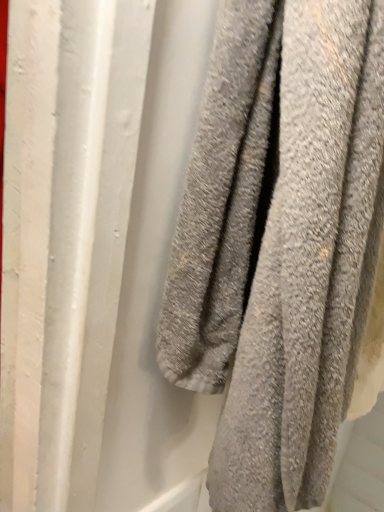
Where is `gray textured towel at center`? gray textured towel at center is located at coordinates (279, 241).

In order to face gray textured towel at center, should I rotate leftwards or rightwards?

Turn right by 23.703 degrees to look at gray textured towel at center.

What do you see at coordinates (279, 241) in the screenshot? Image resolution: width=384 pixels, height=512 pixels. I see `gray textured towel at center` at bounding box center [279, 241].

This screenshot has width=384, height=512. Find the location of `gray textured towel at center`. gray textured towel at center is located at coordinates (279, 241).